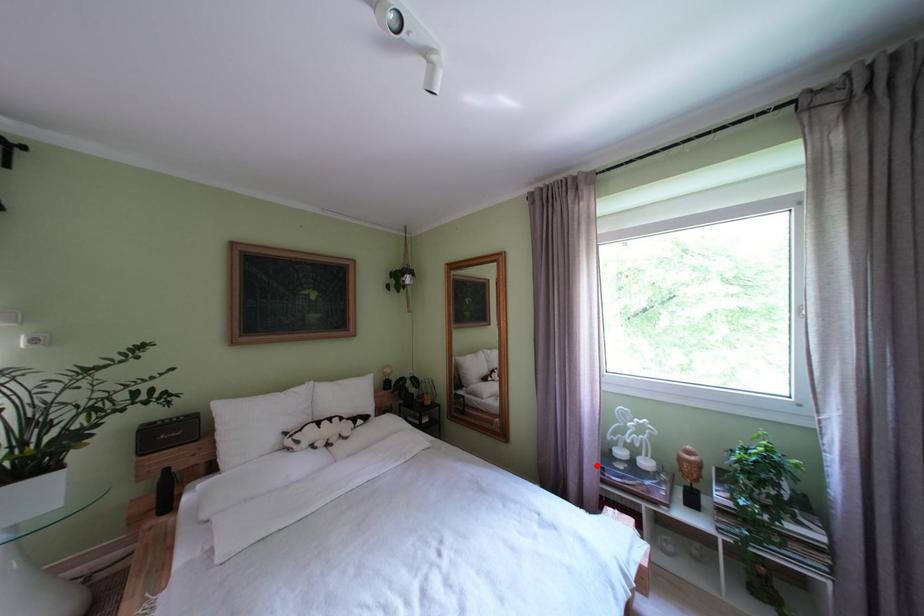
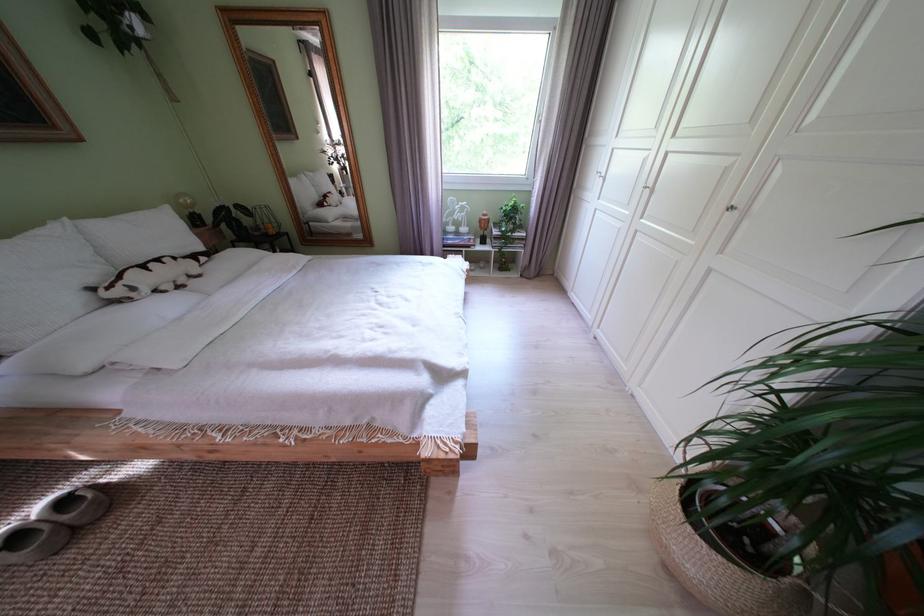
Question: I am providing you with two images of the same scene from different viewpoints. Given a red point in image1, look at the same physical point in image2. Is it:

Choices:
 (A) Closer to the viewpoint
 (B) Farther from the viewpoint

Answer: (A)